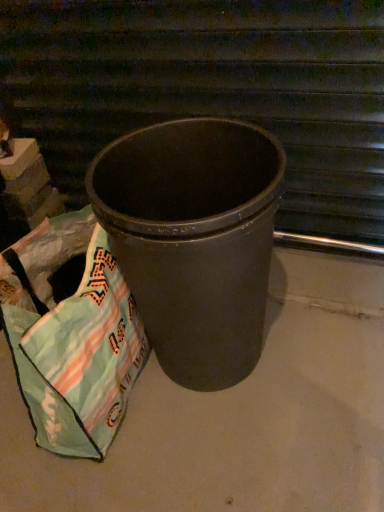
In order to face light green fabric bag at lower left, should I rotate leftwards or rightwards?

Turn left by 17.626 degrees to look at light green fabric bag at lower left.

What do you see at coordinates (77, 356) in the screenshot?
I see `light green fabric bag at lower left` at bounding box center [77, 356].

Image resolution: width=384 pixels, height=512 pixels. Describe the element at coordinates (194, 239) in the screenshot. I see `matte black trash can at center` at that location.

Image resolution: width=384 pixels, height=512 pixels. In order to click on matte black trash can at center in this screenshot , I will do `click(211, 89)`.

Where is `light green fabric bag at lower left`? The width and height of the screenshot is (384, 512). light green fabric bag at lower left is located at coordinates (77, 356).

Based on the photo, from a real-world perspective, is matte black trash can at center positioned under matte black trash can at center based on gravity?

No, from a real-world perspective, matte black trash can at center is not below matte black trash can at center.

Who is smaller, matte black trash can at center or matte black trash can at center?

With smaller size is matte black trash can at center.

Considering the positions of point (327, 30) and point (265, 266), is point (327, 30) closer or farther from the camera than point (265, 266)?

Point (327, 30) is farther from the camera than point (265, 266).

Consider the image. From a real-world perspective, who is located higher, matte gray concrete at center or matte black trash can at center?

matte black trash can at center, from a real-world perspective.

Does matte gray concrete at center contain matte black trash can at center?

No, matte gray concrete at center does not contain matte black trash can at center.

From the image's perspective, is matte black trash can at center located above or below matte black trash can at center?

Clearly, from the image's perspective, matte black trash can at center is below matte black trash can at center.

Who is taller, matte black trash can at center or matte black trash can at center?

With more height is matte black trash can at center.

Considering the relative sizes of matte black trash can at center and matte gray concrete at center in the image provided, is matte black trash can at center shorter than matte gray concrete at center?

No, matte black trash can at center is not shorter than matte gray concrete at center.

Is matte black trash can at center oriented away from matte gray concrete at center?

matte black trash can at center does not have its back to matte gray concrete at center.

How different are the orientations of matte black trash can at center and matte gray concrete at center in degrees?

11.1 degrees.

Could matte gray concrete at center be considered to be inside matte black trash can at center?

No, matte gray concrete at center is not inside matte black trash can at center.

Does light green fabric bag at lower left come in front of matte gray concrete at center?

That is False.

Considering the sizes of objects light green fabric bag at lower left and matte gray concrete at center in the image provided, who is bigger, light green fabric bag at lower left or matte gray concrete at center?

With larger size is matte gray concrete at center.

Considering the sizes of objects light green fabric bag at lower left and matte gray concrete at center in the image provided, who is taller, light green fabric bag at lower left or matte gray concrete at center?

With more height is light green fabric bag at lower left.

How far apart are light green fabric bag at lower left and matte gray concrete at center?

light green fabric bag at lower left and matte gray concrete at center are 26.74 centimeters apart.

Is matte gray concrete at center inside the boundaries of light green fabric bag at lower left, or outside?

matte gray concrete at center is not enclosed by light green fabric bag at lower left.

In terms of height, does matte gray concrete at center look taller or shorter compared to light green fabric bag at lower left?

Considering their sizes, matte gray concrete at center has less height than light green fabric bag at lower left.

From a real-world perspective, is matte gray concrete at center physically located above or below light green fabric bag at lower left?

matte gray concrete at center is below light green fabric bag at lower left.

Between matte gray concrete at center and light green fabric bag at lower left, which one appears on the left side from the viewer's perspective?

From the viewer's perspective, light green fabric bag at lower left appears more on the left side.

Is matte gray concrete at center wider or thinner than matte black trash can at center?

Clearly, matte gray concrete at center has more width compared to matte black trash can at center.

Is matte gray concrete at center positioned far away from matte black trash can at center?

No, matte gray concrete at center is in close proximity to matte black trash can at center.

Which of these two, matte gray concrete at center or matte black trash can at center, stands taller?

matte black trash can at center.

Measure the distance between matte gray concrete at center and matte black trash can at center.

matte gray concrete at center and matte black trash can at center are 25.17 inches apart from each other.

The width and height of the screenshot is (384, 512). Identify the location of stairwell on the left of matte black trash can at center. (211, 89).

At what (x,y) coordinates should I click in order to perform the action: click on waste container that appears in front of the matte gray concrete at center. Please return your answer as a coordinate pair (x, y). The width and height of the screenshot is (384, 512). Looking at the image, I should click on (194, 239).

From the image, which object appears to be nearer to matte gray concrete at center, light green fabric bag at lower left or matte black trash can at center?

light green fabric bag at lower left is closer to matte gray concrete at center.

Considering their positions, is matte black trash can at center positioned further to light green fabric bag at lower left than matte gray concrete at center?

matte gray concrete at center is further to light green fabric bag at lower left.

When comparing their distances from matte black trash can at center, does matte gray concrete at center or light green fabric bag at lower left seem further?

matte gray concrete at center.

Looking at the image, which one is located further to matte black trash can at center, matte black trash can at center or light green fabric bag at lower left?

Based on the image, light green fabric bag at lower left appears to be further to matte black trash can at center.

From the picture: Considering their positions, is matte black trash can at center positioned further to matte gray concrete at center than light green fabric bag at lower left?

matte black trash can at center lies further to matte gray concrete at center than the other object.

From the image, which object appears to be nearer to matte black trash can at center, matte gray concrete at center or matte black trash can at center?

The object closer to matte black trash can at center is matte black trash can at center.

Looking at the image, which one is located further to matte gray concrete at center, matte black trash can at center or light green fabric bag at lower left?

matte black trash can at center is further to matte gray concrete at center.

From the image, which object appears to be nearer to matte black trash can at center, light green fabric bag at lower left or matte gray concrete at center?

Among the two, matte gray concrete at center is located nearer to matte black trash can at center.

At what (x,y) coordinates should I click in order to perform the action: click on waste container between matte black trash can at center and matte gray concrete at center in the vertical direction. Please return your answer as a coordinate pair (x, y). The width and height of the screenshot is (384, 512). Looking at the image, I should click on (194, 239).

Find the location of a particular element. The height and width of the screenshot is (512, 384). grocery bag between matte black trash can at center and matte gray concrete at center from top to bottom is located at coordinates (77, 356).

You are a GUI agent. You are given a task and a screenshot of the screen. Output one action in this format:
    pyautogui.click(x=<x>, y=<y>)
    Task: Click on the waste container that lies between matte black trash can at center and light green fabric bag at lower left from top to bottom
    The width and height of the screenshot is (384, 512).
    Given the screenshot: What is the action you would take?
    pyautogui.click(x=194, y=239)

At what (x,y) coordinates should I click in order to perform the action: click on concrete between light green fabric bag at lower left and matte black trash can at center. Please return your answer as a coordinate pair (x, y). Looking at the image, I should click on (238, 415).